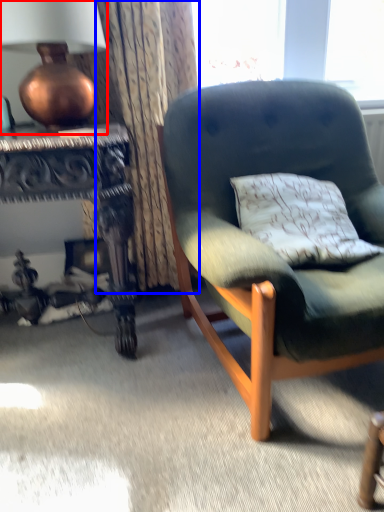
Question: Which point is closer to the camera, lamp (highlighted by a red box) or curtain (highlighted by a blue box)?

Choices:
 (A) lamp
 (B) curtain

Answer: (A)